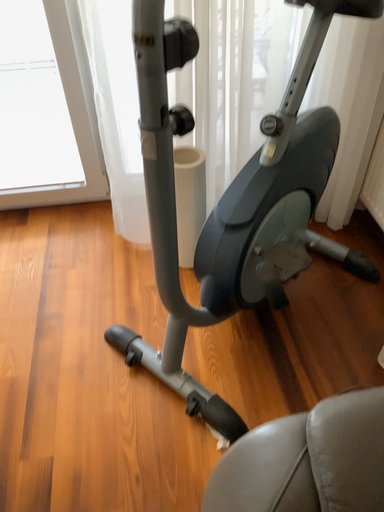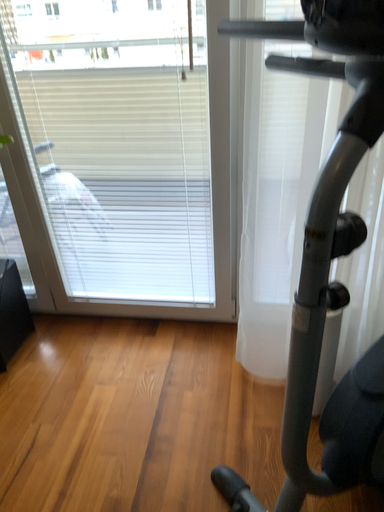
Question: Which way did the camera rotate in the video?

Choices:
 (A) rotated left
 (B) rotated right

Answer: (A)